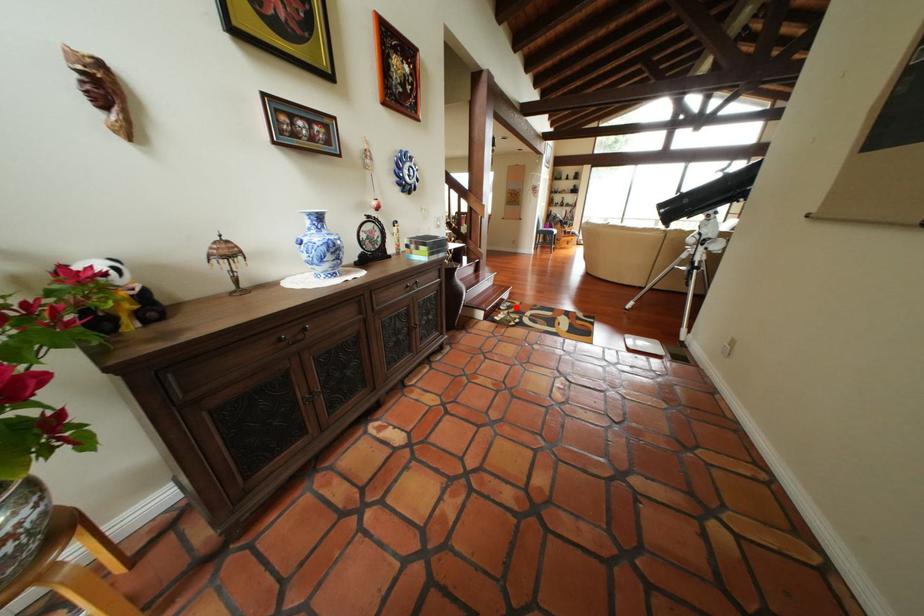
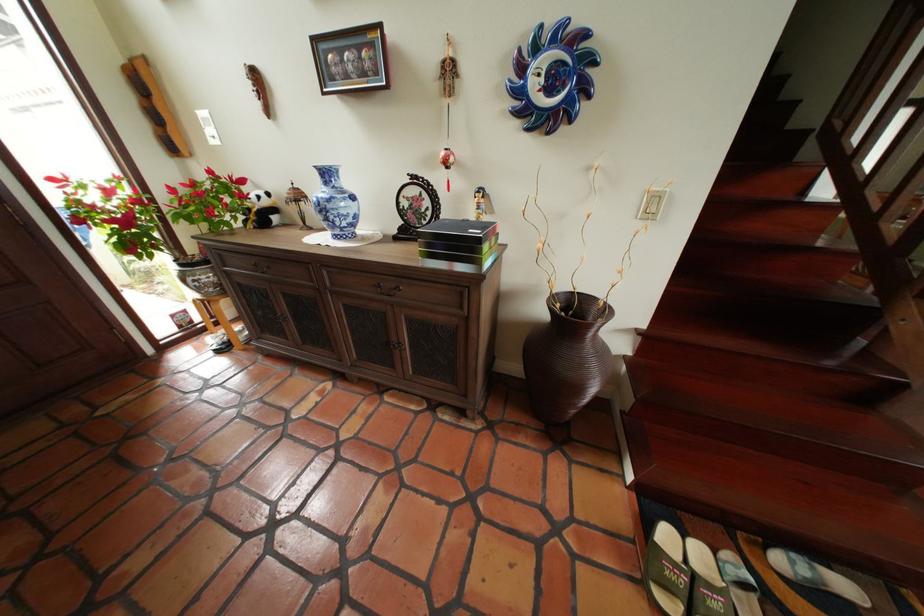
In the second image, find the point that corresponds to the highlighted location in the first image.

(806, 564)